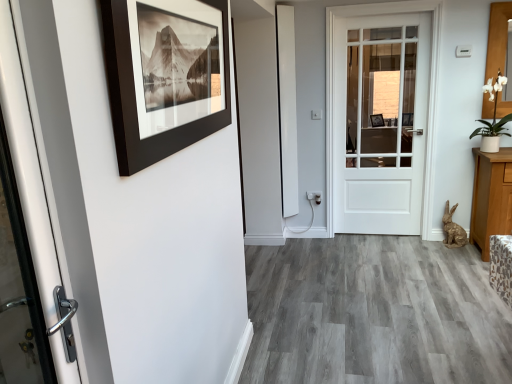
Question: Would you say white matte door at center is inside or outside black matte picture frame at upper left?

Choices:
 (A) inside
 (B) outside

Answer: (B)

Question: From a real-world perspective, is white matte door at center above or below black matte picture frame at upper left?

Choices:
 (A) above
 (B) below

Answer: (B)

Question: Which of these objects is positioned closest to the white matte door at center?

Choices:
 (A) black matte picture frame at upper left
 (B) white ceramic pot at upper right

Answer: (B)

Question: Which of these objects is positioned closest to the white matte door at center?

Choices:
 (A) white ceramic pot at upper right
 (B) black matte picture frame at upper left

Answer: (A)